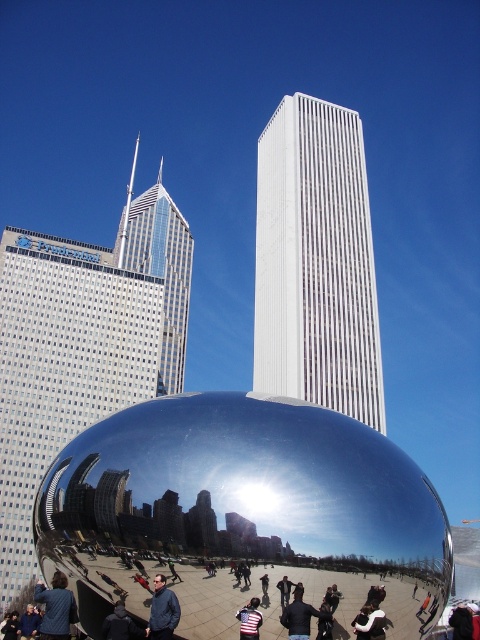
Which is below, denim jacket at lower left or blue denim jacket at lower center?

denim jacket at lower left is below.

Looking at this image, does denim jacket at lower left appear under blue denim jacket at lower center?

Correct, denim jacket at lower left is located below blue denim jacket at lower center.

Is point (51, 620) closer to viewer compared to point (160, 598)?

No, (51, 620) is behind (160, 598).

You are a GUI agent. You are given a task and a screenshot of the screen. Output one action in this format:
    pyautogui.click(x=<x>, y=<y>)
    Task: Click on the denim jacket at lower left
    
    Given the screenshot: What is the action you would take?
    pyautogui.click(x=56, y=608)

Can you confirm if denim jacket at lower left is bigger than striped shirt at center?

Yes.

Is point (57, 588) behind point (250, 616)?

Yes, it is behind point (250, 616).

The image size is (480, 640). Identify the location of denim jacket at lower left. (56, 608).

Is blue denim jacket at lower center positioned at the back of dark blue jacket at center?

Yes, it is behind dark blue jacket at center.

Is blue denim jacket at lower center shorter than dark blue jacket at center?

No.

Where is `blue denim jacket at lower center`? Image resolution: width=480 pixels, height=640 pixels. blue denim jacket at lower center is located at coordinates (163, 611).

Where is `blue denim jacket at lower center`? blue denim jacket at lower center is located at coordinates (163, 611).